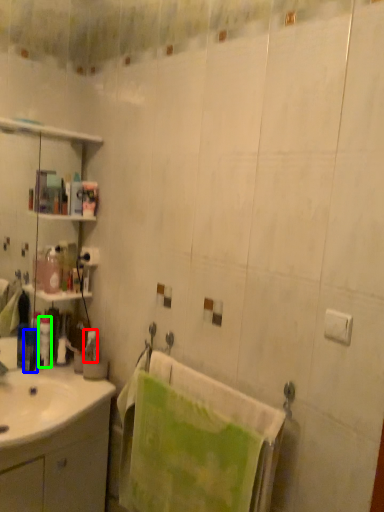
Question: Which object is positioned farthest from toiletry (highlighted by a red box)? Select from toiletry (highlighted by a blue box) and toiletry (highlighted by a green box).

Choices:
 (A) toiletry
 (B) toiletry

Answer: (A)